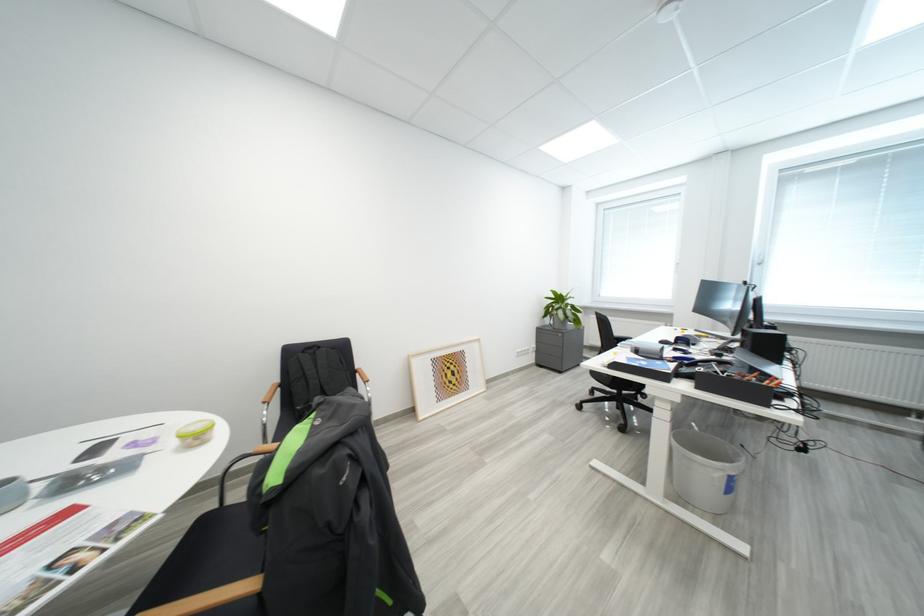
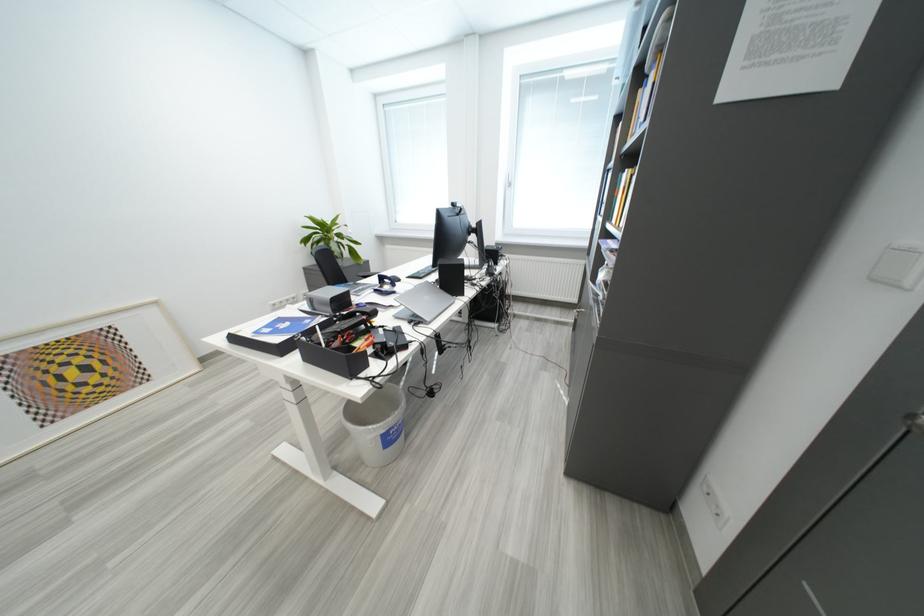
Locate, in the second image, the point that corresponds to the point at 460,370 in the first image.

(88, 363)